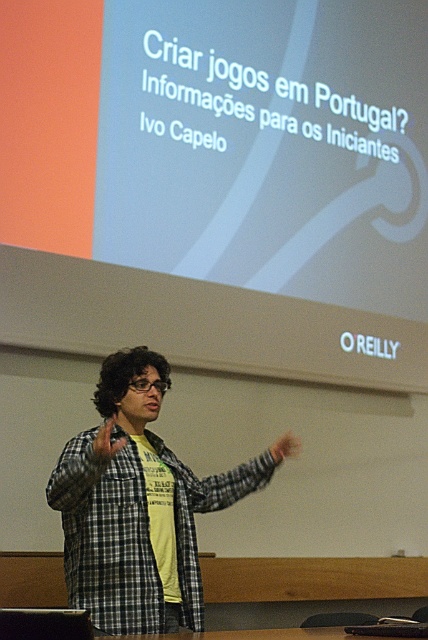
Question: Which point is farther to the camera?

Choices:
 (A) checkered fabric shirt at center
 (B) brown leather hand at center

Answer: (B)

Question: Is the position of checkered fabric shirt at center more distant than that of brown leather hand at center?

Choices:
 (A) no
 (B) yes

Answer: (A)

Question: Does checkered fabric shirt at center appear over brown leather hand at center?

Choices:
 (A) no
 (B) yes

Answer: (A)

Question: Which object is farther from the camera taking this photo?

Choices:
 (A) checkered fabric shirt at center
 (B) brown leather hand at center

Answer: (B)

Question: From the image, what is the correct spatial relationship of checkered fabric shirt at center in relation to brown leather hand at center?

Choices:
 (A) right
 (B) left

Answer: (B)

Question: Which of the following is the farthest from the observer?

Choices:
 (A) checkered fabric shirt at center
 (B) brown leather hand at center

Answer: (B)